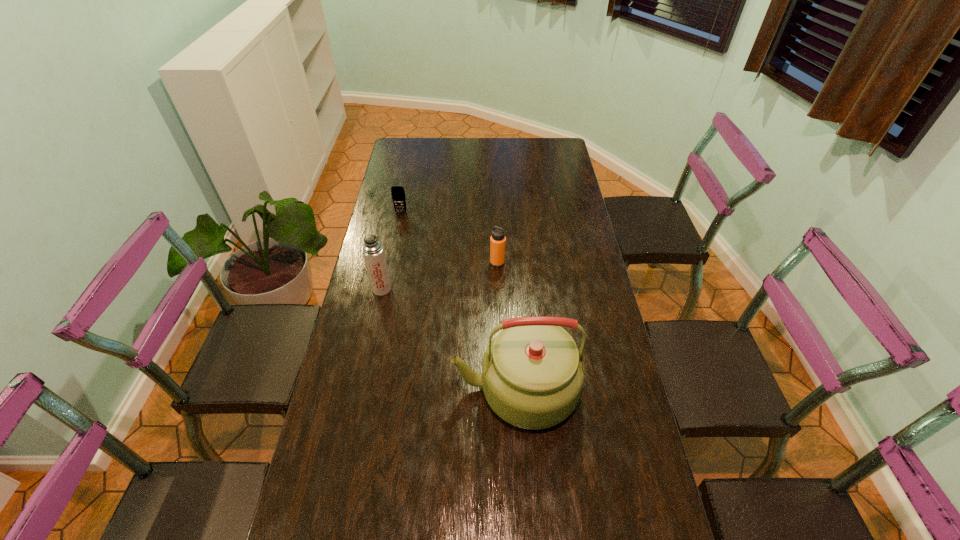
This screenshot has height=540, width=960. I want to click on the nearest object, so click(532, 375).

I want to click on the tallest object, so click(x=532, y=375).

This screenshot has width=960, height=540. I want to click on the taller thermos bottle, so click(x=373, y=252).

Locate an element on the screen. the third shortest object is located at coordinates (373, 252).

Locate an element on the screen. This screenshot has width=960, height=540. the right thermos bottle is located at coordinates (498, 240).

Identify the location of the shorter thermos bottle. The height and width of the screenshot is (540, 960). (498, 240).

Locate an element on the screen. the shortest object is located at coordinates (397, 192).

Locate an element on the screen. the farthest object is located at coordinates (397, 192).

Find the location of a particular element. This screenshot has width=960, height=540. vacant region located 0.160m at the spout of the tallest object is located at coordinates (396, 389).

I want to click on free space located at the spout of the tallest object, so coord(431,389).